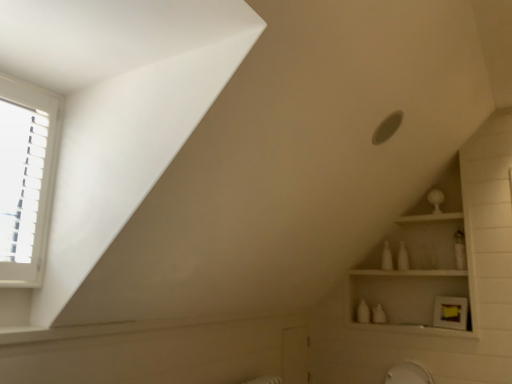
What do you see at coordinates (415, 266) in the screenshot?
I see `white wood shelf at upper right` at bounding box center [415, 266].

The image size is (512, 384). I want to click on white wood shelf at upper right, so click(415, 266).

Locate an element on the screen. This screenshot has width=512, height=384. white wood shelf at upper right is located at coordinates (415, 266).